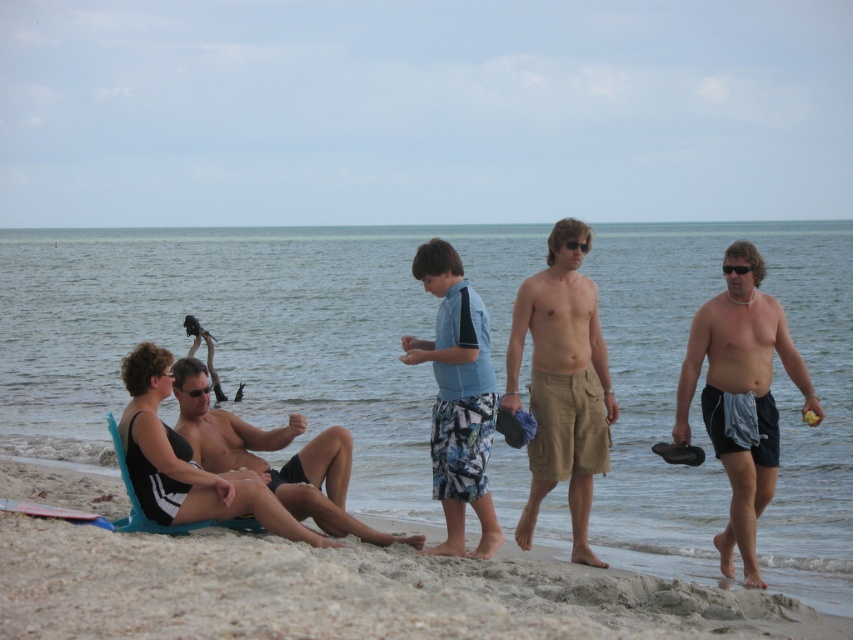
Is blue printed shorts at center smaller than black matte swimsuit at center?

Correct, blue printed shorts at center occupies less space than black matte swimsuit at center.

Measure the distance between blue printed shorts at center and camera.

blue printed shorts at center is 10.18 meters away from camera.

I want to click on blue printed shorts at center, so click(x=457, y=397).

Which is in front, point (509, 349) or point (338, 432)?

Point (338, 432)

Between point (602, 433) and point (241, 464), which one is positioned in front?

Point (241, 464) is more forward.

Locate an element on the screen. tan cotton shorts at center is located at coordinates (561, 384).

Who is positioned more to the right, clear blue water at center or gray fabric towel at right?

gray fabric towel at right is more to the right.

Who is more distant from viewer, (15, 449) or (732, 433)?

The point (15, 449) is behind.

The image size is (853, 640). Identify the location of clear blue water at center. pos(245,333).